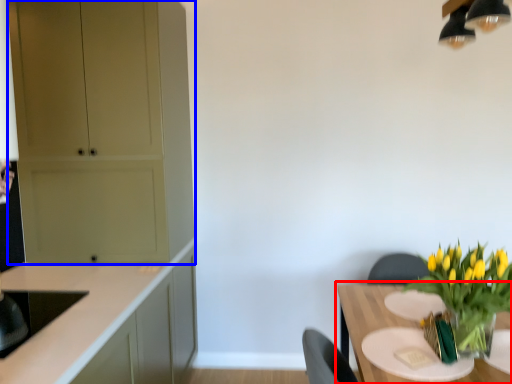
Question: Which object appears farthest to the camera in this image, table (highlighted by a red box) or cabinetry (highlighted by a blue box)?

Choices:
 (A) table
 (B) cabinetry

Answer: (B)